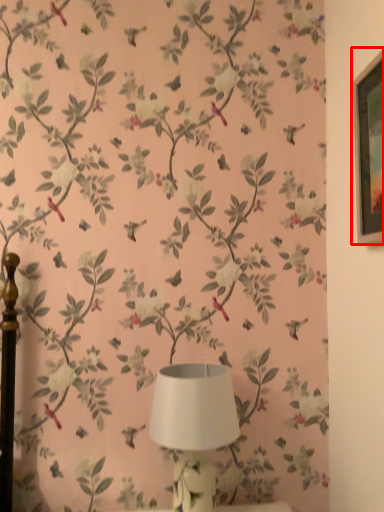
Question: Observing the image, what is the correct spatial positioning of picture frame (annotated by the red box) in reference to lamp?

Choices:
 (A) left
 (B) right

Answer: (B)